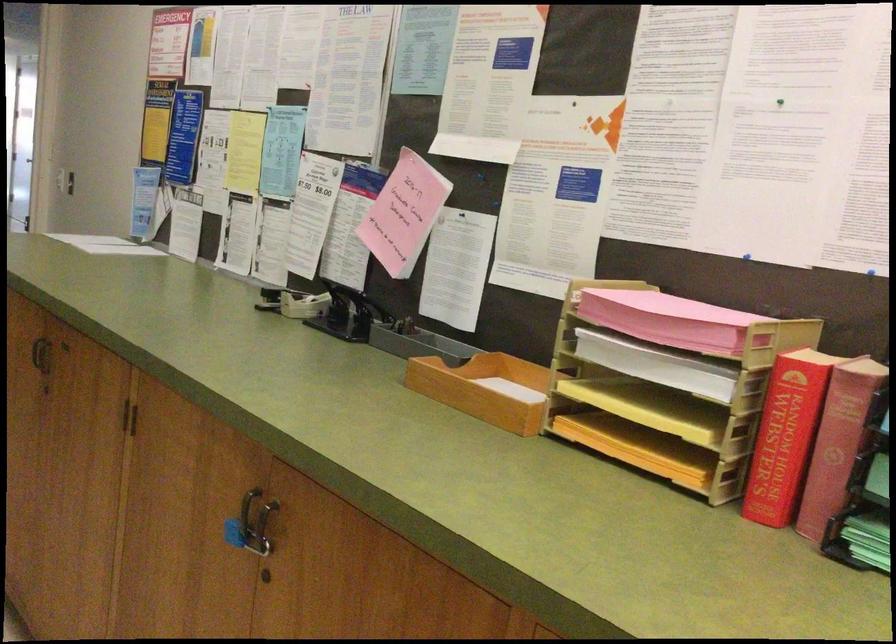
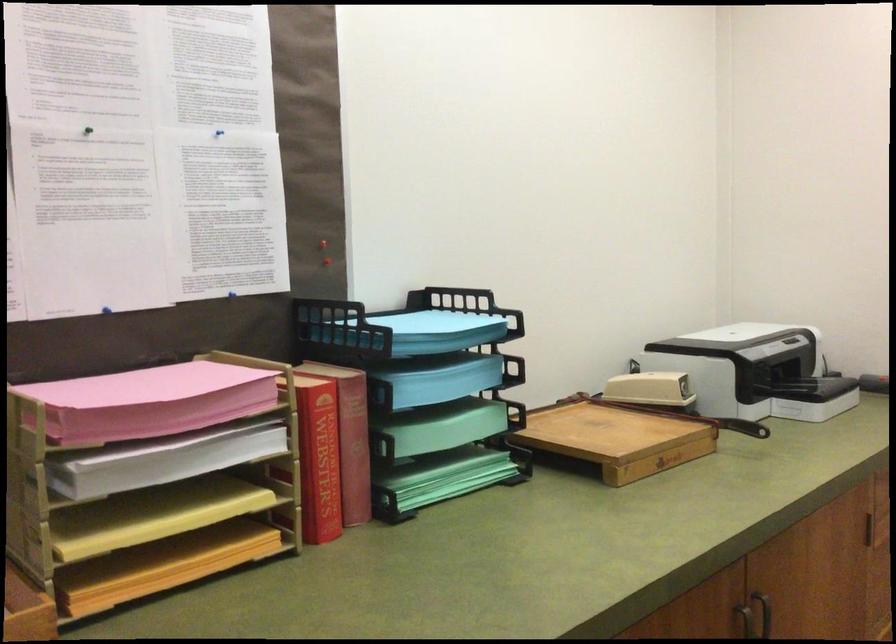
The point at (667, 357) is marked in the first image. Where is the corresponding point in the second image?

(179, 450)